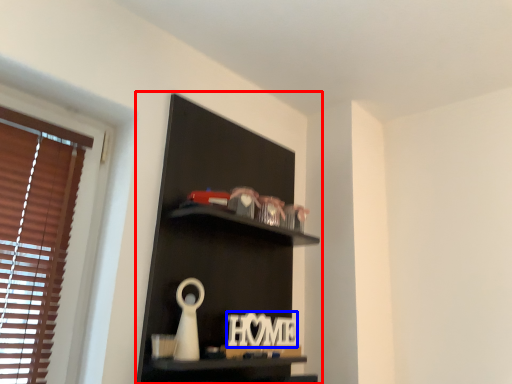
Question: Which point is further to the camera, shelf (highlighted by a red box) or letter (highlighted by a blue box)?

Choices:
 (A) shelf
 (B) letter

Answer: (B)